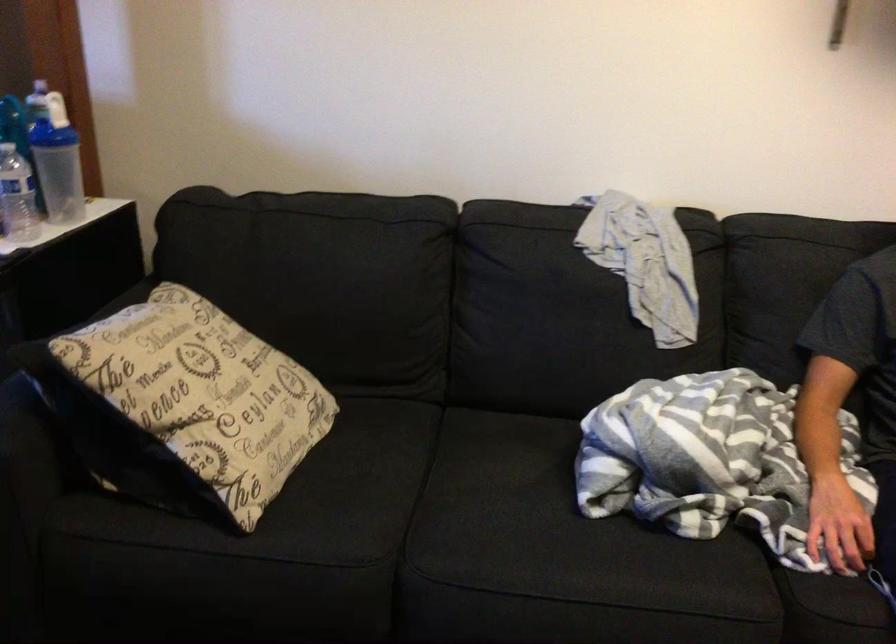
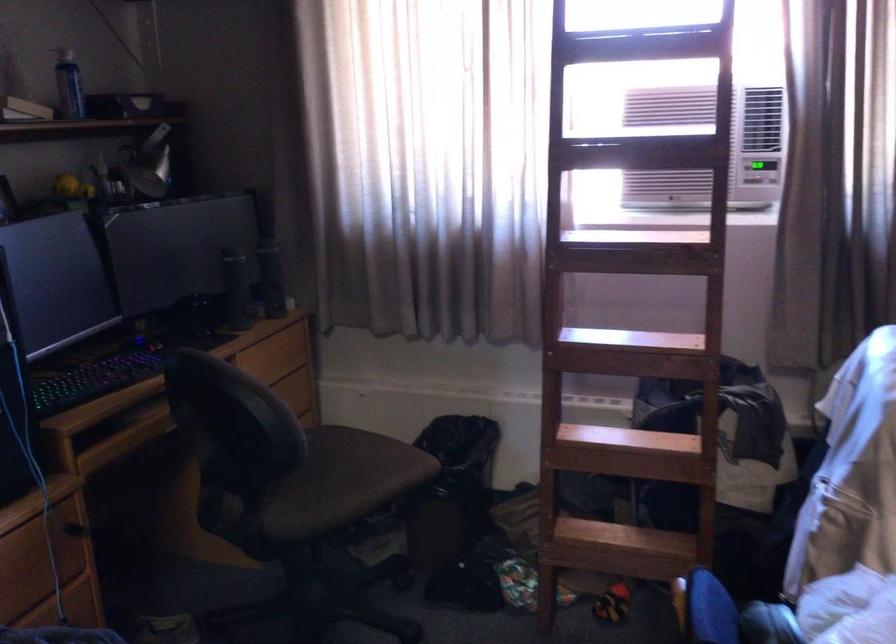
Question: The first image is from the beginning of the video and the second image is from the end. How did the camera likely rotate when shooting the video?

Choices:
 (A) Left
 (B) Right
 (C) Up
 (D) Down

Answer: (A)